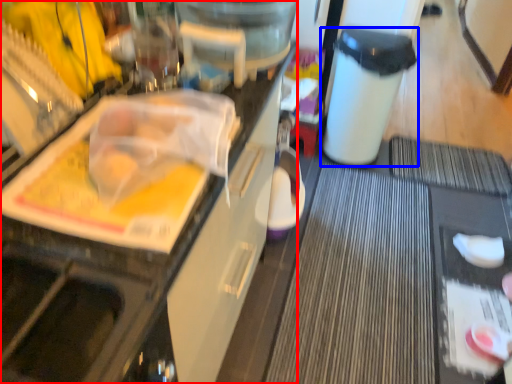
Question: Which object is closer to the camera taking this photo, cabinetry (highlighted by a red box) or trash bin/can (highlighted by a blue box)?

Choices:
 (A) cabinetry
 (B) trash bin/can

Answer: (A)